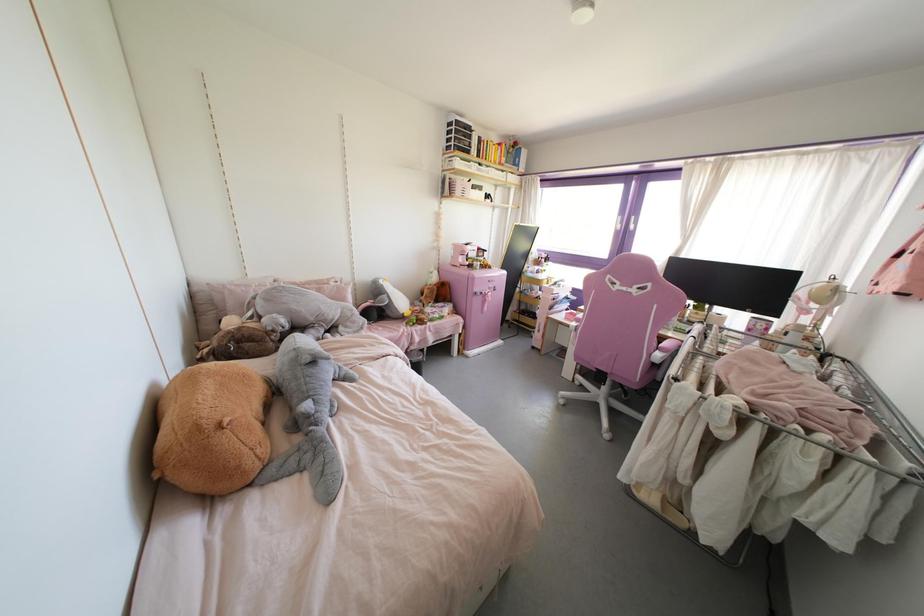
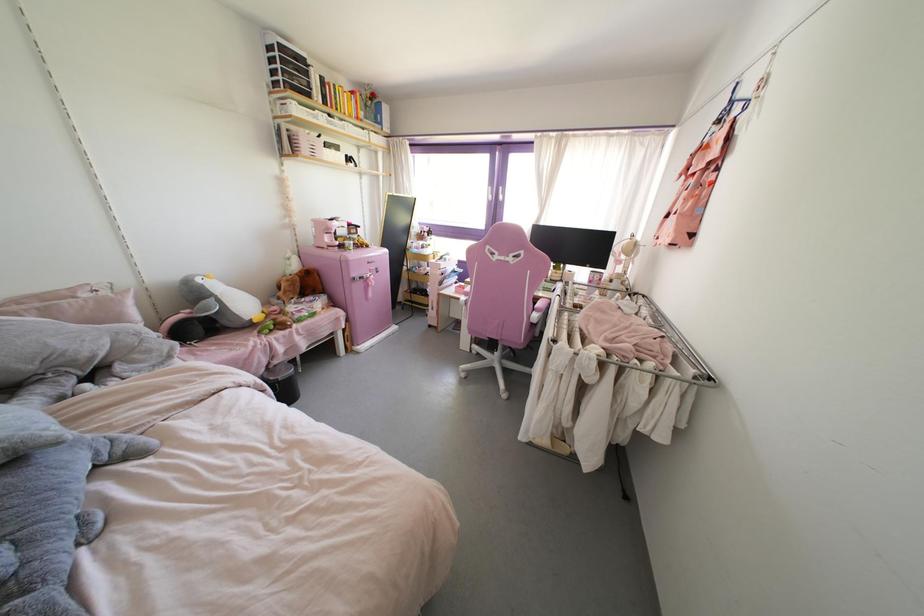
Question: I am providing you with two images of the same scene from different viewpoints. Which of the following objects are not visible in image2?

Choices:
 (A) blue clothes hanger
 (B) pink pillow
 (C) grey stuffed shark
 (D) none of these

Answer: (D)